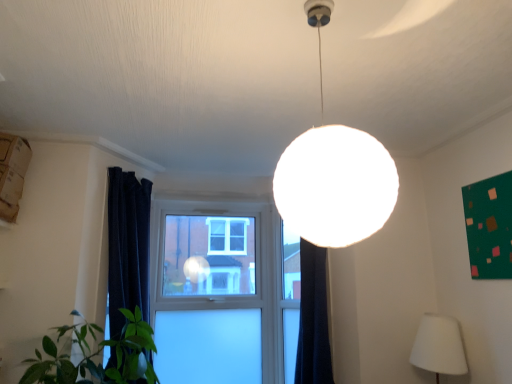
Question: From the image's perspective, is white fabric lampshade at lower right, the 1th lamp positioned from the bottom, located above or below green matte bulletin board at upper right?

Choices:
 (A) below
 (B) above

Answer: (A)

Question: From their relative heights in the image, would you say white fabric lampshade at lower right, which appears as the 2th lamp when viewed from the left, is taller or shorter than green matte bulletin board at upper right?

Choices:
 (A) tall
 (B) short

Answer: (B)

Question: Which object is the farthest from the white fabric lampshade at lower right, the 1th lamp viewed from the back?

Choices:
 (A) green matte bulletin board at upper right
 (B) white matte sphere at center, which is the first lamp in top-to-bottom order
 (C) clear glass window at center

Answer: (B)

Question: Considering the real-world distances, which object is closest to the white matte sphere at center, marked as the 2th lamp in a back-to-front arrangement?

Choices:
 (A) clear glass window at center
 (B) white fabric lampshade at lower right, arranged as the 2th lamp when viewed from the front
 (C) green matte bulletin board at upper right

Answer: (C)